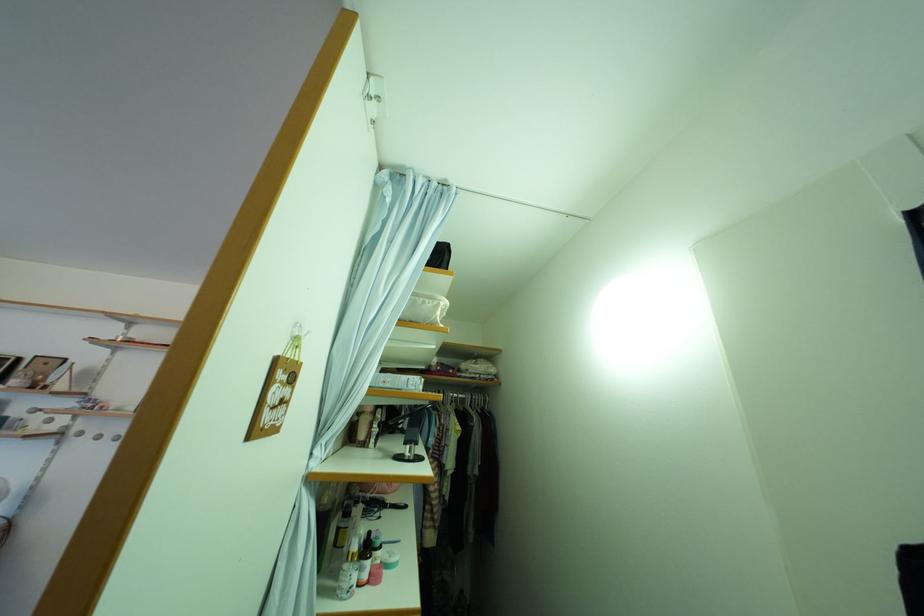
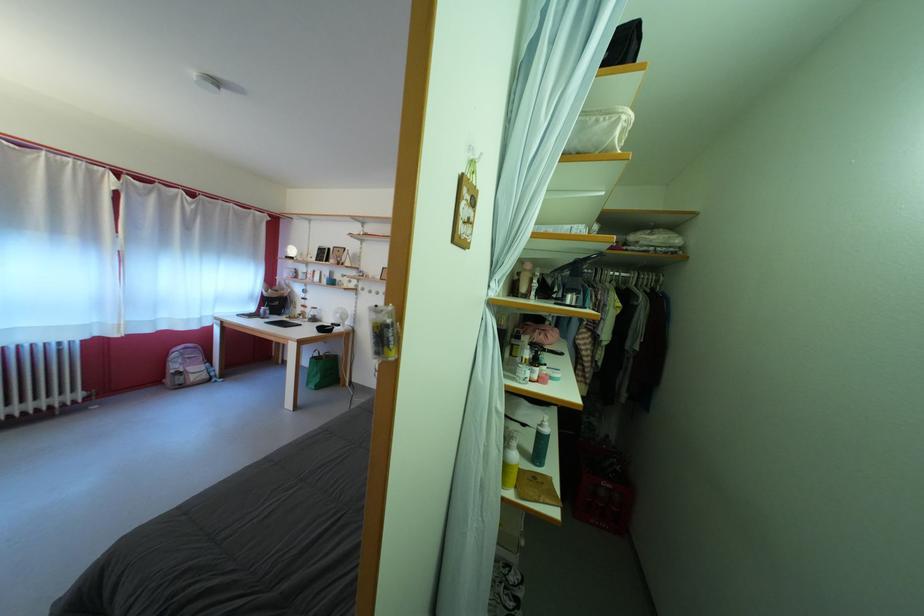
In the second image, find the point that corresponds to point (468, 402) in the first image.

(631, 281)